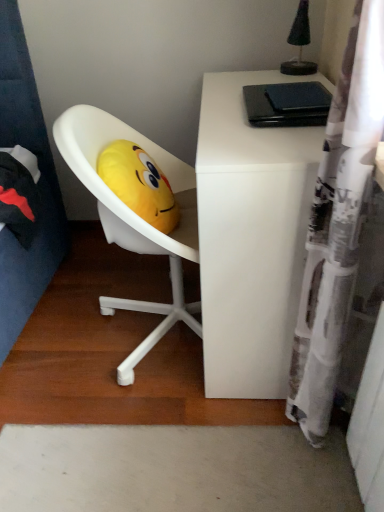
Image resolution: width=384 pixels, height=512 pixels. What are the coordinates of `free space above white matte desk at upper right (from a real-world perspective)` in the screenshot? It's located at (254, 106).